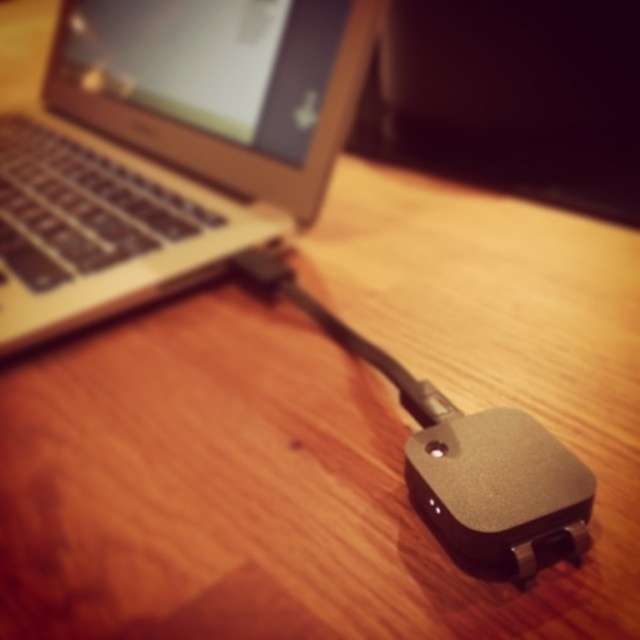
You are organizing a desk and need to place the satin gold laptop at upper left and the satin black mouse at lower right. Based on their positions, which item is closer to the left edge of the desk?

The satin gold laptop at upper left is positioned on the left side of the satin black mouse at lower right, so it is closer to the left edge of the desk.